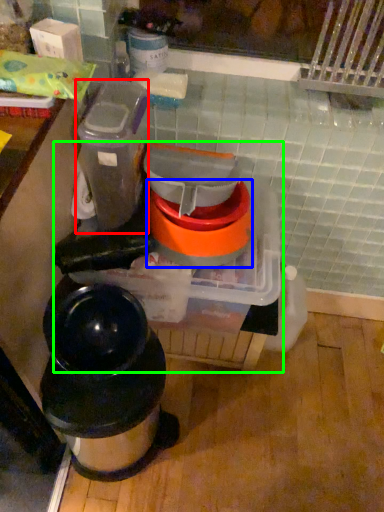
Question: Which object is the farthest from appliance (highlighted by a red box)? Choose among these: appliance (highlighted by a blue box) or appliance (highlighted by a green box).

Choices:
 (A) appliance
 (B) appliance

Answer: (B)